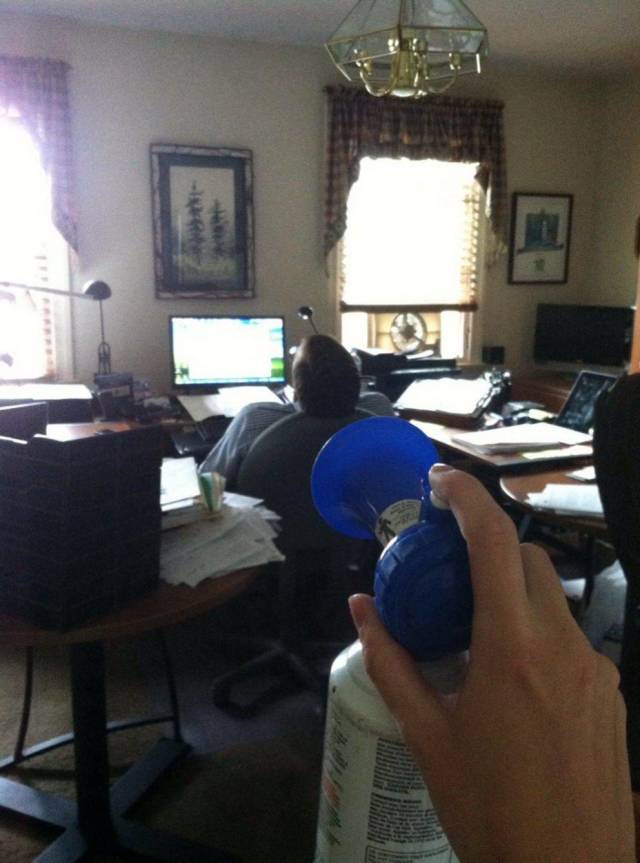
This screenshot has width=640, height=863. What are the coordinates of `computer monitors` in the screenshot? It's located at (564, 331), (237, 344).